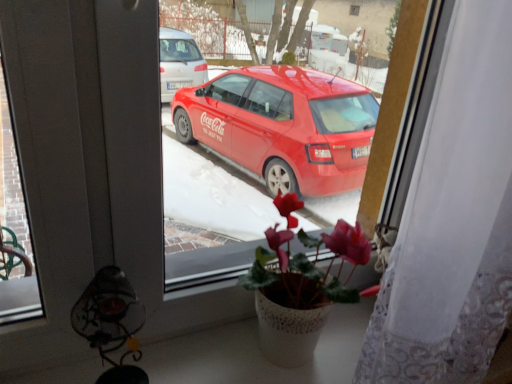
Question: Can you confirm if pink matte cyclamen at center is thinner than white lace curtain at right?

Choices:
 (A) yes
 (B) no

Answer: (A)

Question: Could you tell me if pink matte cyclamen at center is facing white lace curtain at right?

Choices:
 (A) no
 (B) yes

Answer: (A)

Question: Does pink matte cyclamen at center appear on the left side of white lace curtain at right?

Choices:
 (A) yes
 (B) no

Answer: (A)

Question: Are pink matte cyclamen at center and white lace curtain at right beside each other?

Choices:
 (A) no
 (B) yes

Answer: (A)

Question: Is pink matte cyclamen at center far from white lace curtain at right?

Choices:
 (A) yes
 (B) no

Answer: (B)

Question: In the image, is metallic wire lamp at lower left positioned in front of or behind pink matte cyclamen at center?

Choices:
 (A) behind
 (B) front

Answer: (B)

Question: Considering the positions of metallic wire lamp at lower left and pink matte cyclamen at center in the image, is metallic wire lamp at lower left wider or thinner than pink matte cyclamen at center?

Choices:
 (A) wide
 (B) thin

Answer: (B)

Question: Is point (113, 309) positioned closer to the camera than point (330, 288)?

Choices:
 (A) farther
 (B) closer

Answer: (B)

Question: Considering the relative positions of metallic wire lamp at lower left and pink matte cyclamen at center in the image provided, is metallic wire lamp at lower left to the left or to the right of pink matte cyclamen at center?

Choices:
 (A) left
 (B) right

Answer: (A)

Question: Considering the positions of pink matte cyclamen at center and metallic wire lamp at lower left in the image, is pink matte cyclamen at center bigger or smaller than metallic wire lamp at lower left?

Choices:
 (A) big
 (B) small

Answer: (A)

Question: Based on their positions, is pink matte cyclamen at center located to the left or right of metallic wire lamp at lower left?

Choices:
 (A) right
 (B) left

Answer: (A)

Question: Is pink matte cyclamen at center taller or shorter than metallic wire lamp at lower left?

Choices:
 (A) tall
 (B) short

Answer: (A)

Question: Is pink matte cyclamen at center wider or thinner than metallic wire lamp at lower left?

Choices:
 (A) wide
 (B) thin

Answer: (A)

Question: Is white lace curtain at right spatially inside pink matte cyclamen at center, or outside of it?

Choices:
 (A) outside
 (B) inside

Answer: (A)

Question: Does point (457, 243) appear closer or farther from the camera than point (342, 256)?

Choices:
 (A) farther
 (B) closer

Answer: (B)